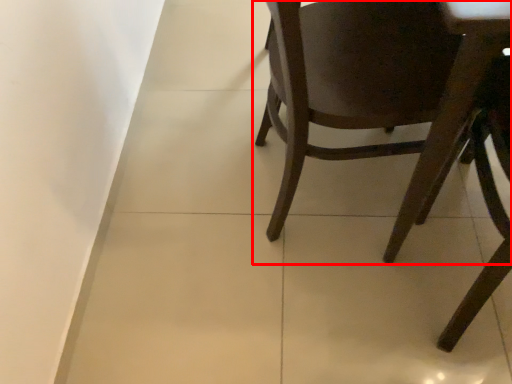
Question: From the image's perspective, where is chair (annotated by the red box) located relative to chair?

Choices:
 (A) below
 (B) above

Answer: (B)